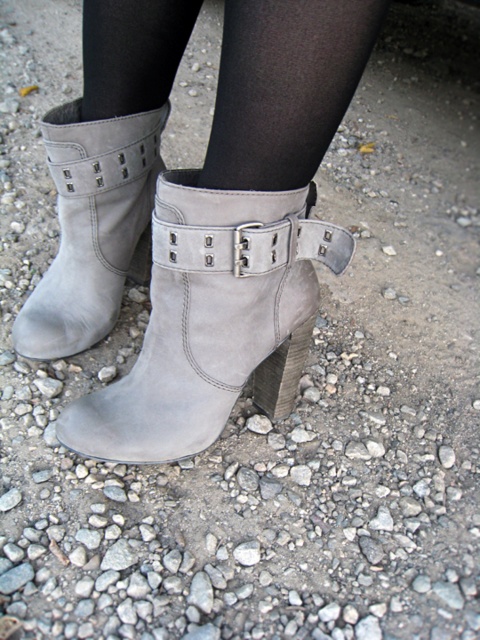
You are a photographer adjusting the camera focus. You need to focus on both the point at [96,392] and the point at [68,193]. Which point should you focus on first to ensure the one closer to the camera is sharp?

Point [68,193] is closer to the camera than point [96,392], so you should focus on point [68,193] first to ensure it is sharp.

You are a photographer trying to capture a detailed image of the suede gray boot at center. If your camera is positioned at a standard 36 inches away, will you need to move closer or farther away to ensure the boot fills the frame properly?

The suede gray boot at center is currently 28.86 inches away from the camera, which is closer than the standard 36 inches. To ensure the boot fills the frame properly, you should move the camera farther away to match the standard distance of 36 inches.